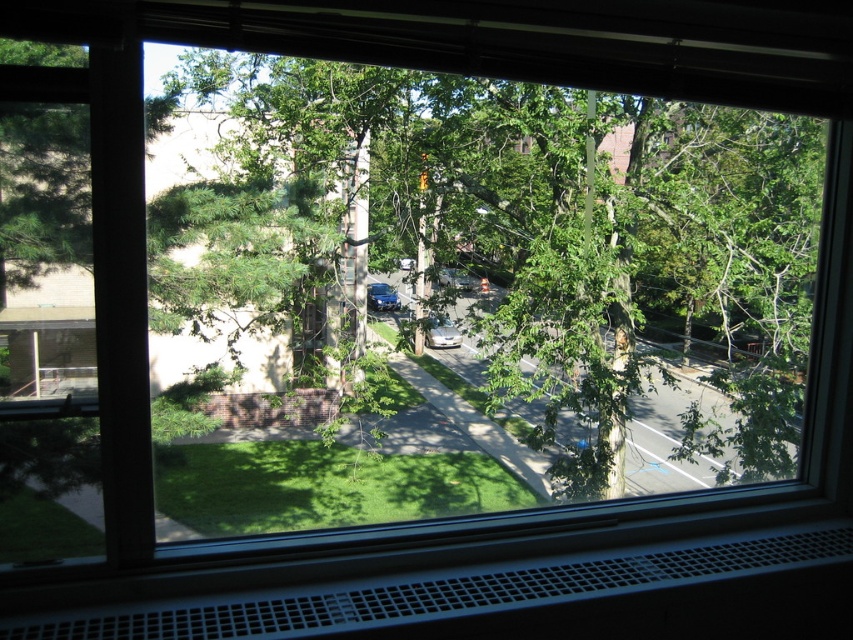
Question: Does metallic blue sedan at center appear on the right side of metallic silver sedan at center?

Choices:
 (A) no
 (B) yes

Answer: (A)

Question: Which of these objects is positioned closest to the shiny blue sedan at center?

Choices:
 (A) silver metallic car at center
 (B) metallic silver sedan at center
 (C) metallic blue sedan at center

Answer: (B)

Question: Which of these objects is positioned closest to the metallic silver sedan at center?

Choices:
 (A) silver metallic car at center
 (B) shiny blue sedan at center
 (C) metallic blue sedan at center

Answer: (B)

Question: Which point is closer to the camera taking this photo?

Choices:
 (A) (383, 284)
 (B) (409, 262)
 (C) (444, 321)
 (D) (471, 284)

Answer: (C)

Question: Does metallic blue sedan at center have a smaller size compared to metallic silver sedan at center?

Choices:
 (A) no
 (B) yes

Answer: (B)

Question: Can you confirm if silver metallic car at center is positioned to the right of metallic blue sedan at center?

Choices:
 (A) no
 (B) yes

Answer: (B)